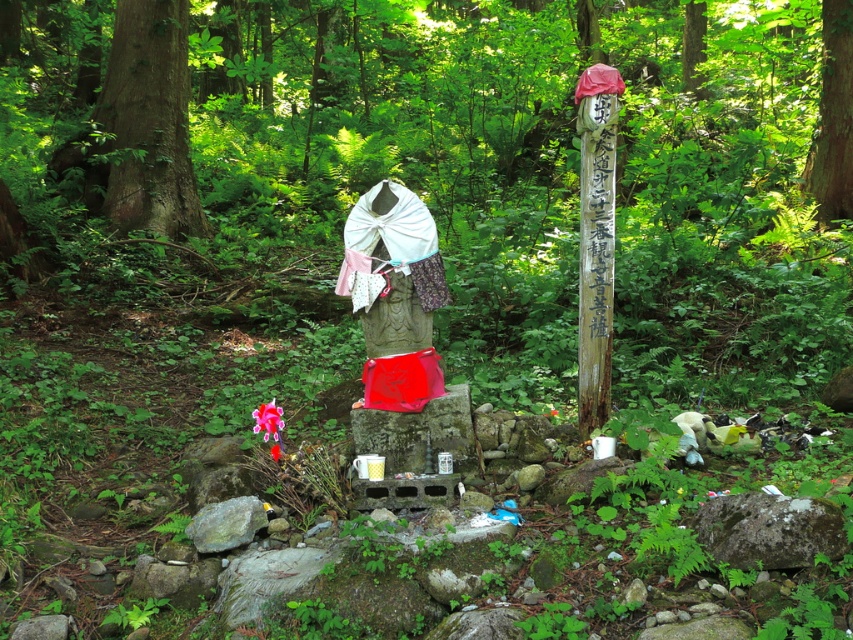
Question: Is wooden carved totem pole at center right to the left of smooth brown tree trunk at center from the viewer's perspective?

Choices:
 (A) no
 (B) yes

Answer: (B)

Question: Does green rough bark tree at left appear over wooden carved totem pole at center right?

Choices:
 (A) yes
 (B) no

Answer: (A)

Question: Among these points, which one is farthest from the camera?

Choices:
 (A) (146, 54)
 (B) (590, 112)
 (C) (834, 161)

Answer: (A)

Question: Which of these objects is positioned farthest from the green rough bark tree at left?

Choices:
 (A) smooth brown tree trunk at center
 (B) wooden carved totem pole at center right

Answer: (B)

Question: Can you confirm if wooden carved totem pole at center right is positioned below smooth brown tree trunk at center?

Choices:
 (A) no
 (B) yes

Answer: (B)

Question: Estimate the real-world distances between objects in this image. Which object is closer to the wooden carved totem pole at center right?

Choices:
 (A) green rough bark tree at left
 (B) smooth brown tree trunk at center

Answer: (B)